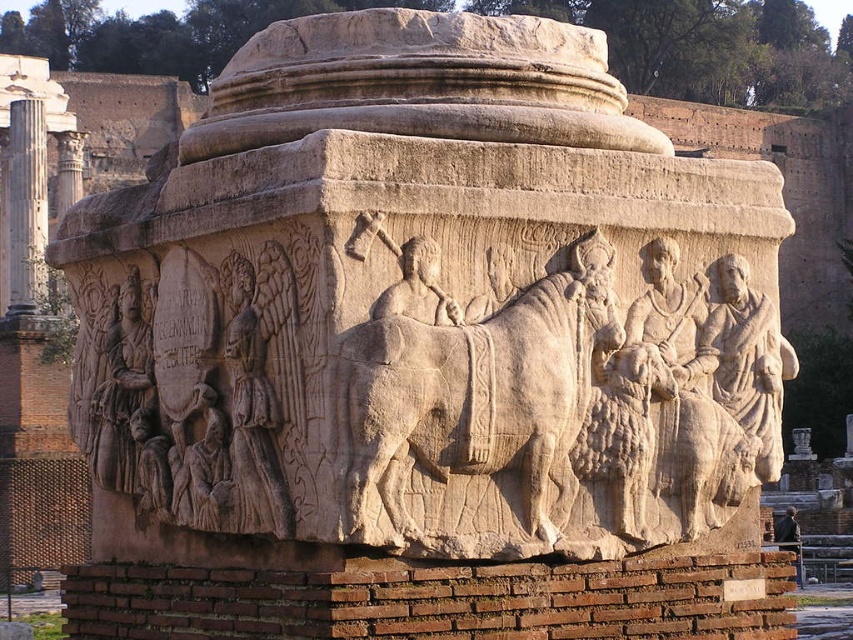
Question: Which point is farther to the camera?

Choices:
 (A) (42, 129)
 (B) (136, 456)
 (C) (370, 456)
 (D) (723, 368)

Answer: (A)

Question: Which point is farther to the camera?

Choices:
 (A) (770, 326)
 (B) (10, 259)
 (C) (115, 451)
 (D) (567, 449)

Answer: (B)

Question: Is light beige stone figure at center bigger than light beige stone figures at lower left?

Choices:
 (A) yes
 (B) no

Answer: (A)

Question: Where is beige stone horse at center located in relation to light beige stone figure at center in the image?

Choices:
 (A) below
 (B) above

Answer: (A)

Question: Which of the following is the closest to the observer?

Choices:
 (A) (132, 285)
 (B) (592, 352)
 (C) (15, 259)

Answer: (B)

Question: Is beige stone horse at center to the left of light beige stone figure at center from the viewer's perspective?

Choices:
 (A) yes
 (B) no

Answer: (A)